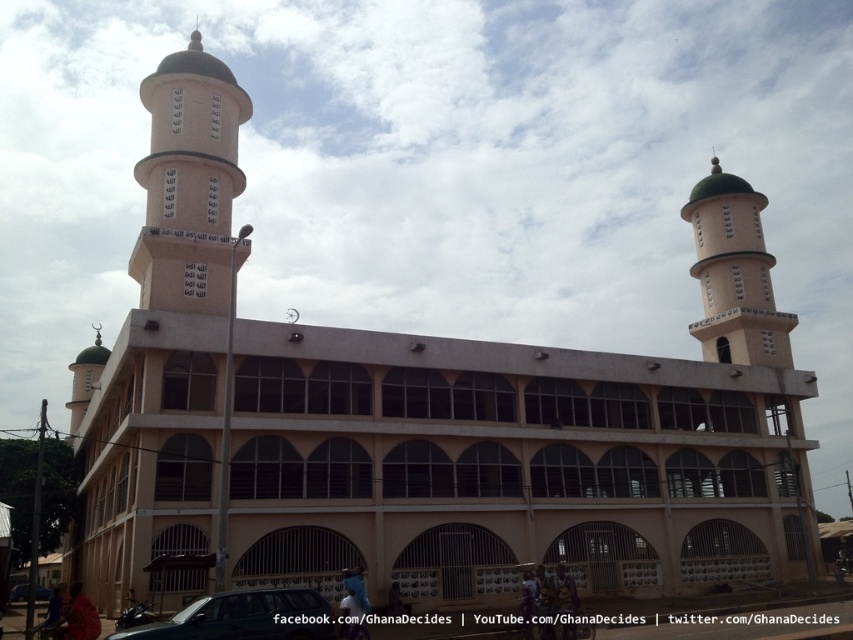
You are standing in front of the mosque and want to take a photo that includes both the matte white minaret at left and the metallic silver car at lower left. Which object should you position closer to the top of your camera frame?

You should position the matte white minaret at left closer to the top of your camera frame because it has a greater height compared to the metallic silver car at lower left.